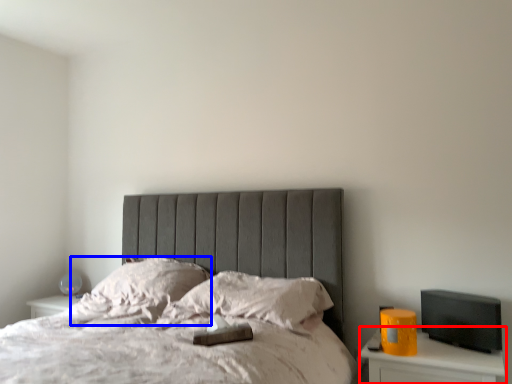
Question: Among these objects, which one is farthest to the camera, nightstand (highlighted by a red box) or pillow (highlighted by a blue box)?

Choices:
 (A) nightstand
 (B) pillow

Answer: (B)